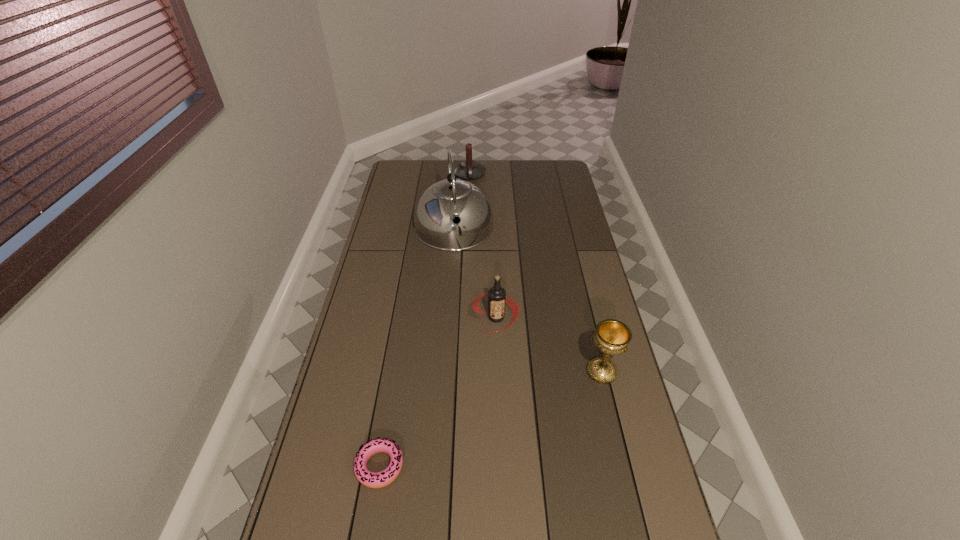
You are a GUI agent. You are given a task and a screenshot of the screen. Output one action in this format:
    pyautogui.click(x=<x>, y=<y>)
    Task: Click on the vacant space that is in between the shortest object and the third nearest object
    This screenshot has height=540, width=960.
    Given the screenshot: What is the action you would take?
    pyautogui.click(x=438, y=392)

Identify the location of free space between the root beer and the farthest object. (483, 246).

You are a GUI agent. You are given a task and a screenshot of the screen. Output one action in this format:
    pyautogui.click(x=<x>, y=<y>)
    Task: Click on the unoccupied position between the third farthest object and the nearest object
    The image size is (960, 540).
    Given the screenshot: What is the action you would take?
    pyautogui.click(x=438, y=392)

Identify the location of free space between the candle and the shortest object. tap(424, 320).

Where is `free space that is in between the nearest object and the candle`? The image size is (960, 540). free space that is in between the nearest object and the candle is located at coordinates (424, 320).

The image size is (960, 540). I want to click on vacant space in between the tallest object and the root beer, so click(x=475, y=273).

This screenshot has width=960, height=540. What are the coordinates of `empty location between the nearest object and the candle` in the screenshot? It's located at (424, 320).

Identify the location of free space between the rightmost object and the shortest object. This screenshot has width=960, height=540. (491, 419).

Where is `object that can be found as the fourth closest to the root beer`? The image size is (960, 540). object that can be found as the fourth closest to the root beer is located at coordinates (468, 169).

Identify which object is located as the nearest to the kettle. Please provide its 2D coordinates. Your answer should be formatted as a tuple, i.e. [(x, y)], where the tuple contains the x and y coordinates of a point satisfying the conditions above.

[(468, 169)]